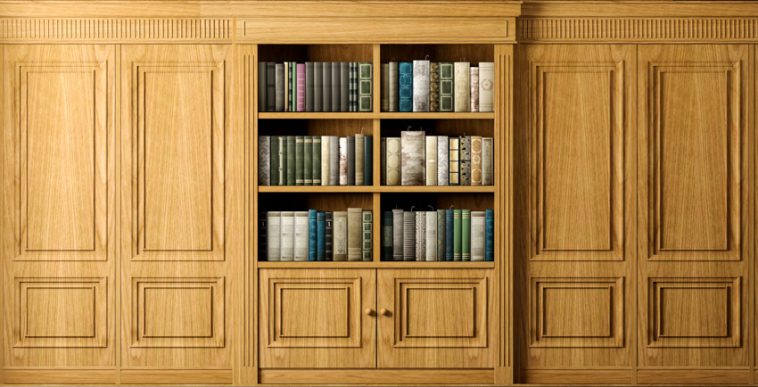
Where is `6 divided shelves`? 6 divided shelves is located at coordinates (330, 95), (434, 86), (289, 167), (459, 149), (296, 243), (443, 225).